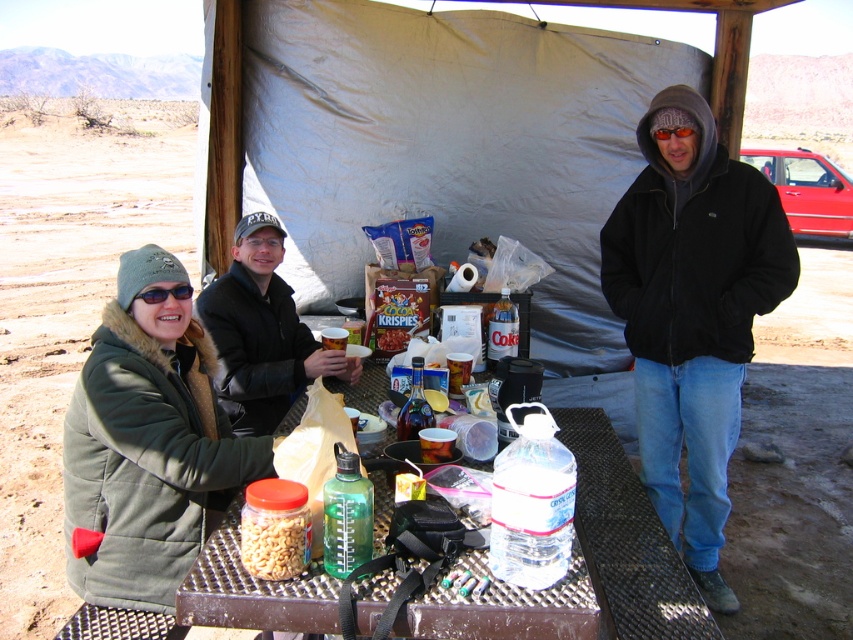
You are a photographer standing behind the metallic brown table at center and the black leather jacket at center. Which object is closer to you?

The metallic brown table at center is closer to you because it is positioned on the right side of the black leather jacket at center, meaning the table is between you and the jacket.

You are planning to set up a tent in this desert area. You see the white fabric tent at center and the black fleece jacket at right. Which object is located above the other?

The white fabric tent at center is positioned over the black fleece jacket at right, meaning the tent is above the jacket.

You are standing at the picnic table in the desert scene. There is a point marked at coordinates (276, 93). Based on the scene description, where is this point located?

The point at coordinates (276, 93) is located on the white fabric tent at center.